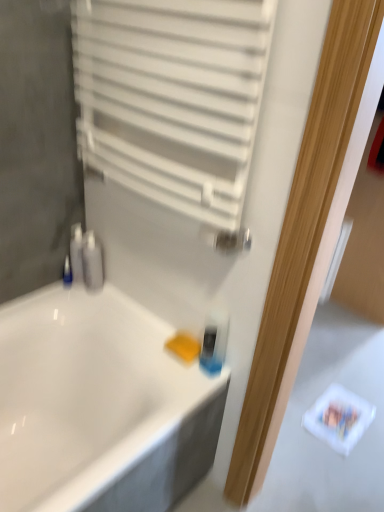
Locate an element on the screen. The width and height of the screenshot is (384, 512). free point to the right of blue plastic bottle at left, which is the first toiletry in left-to-right order is located at coordinates (104, 296).